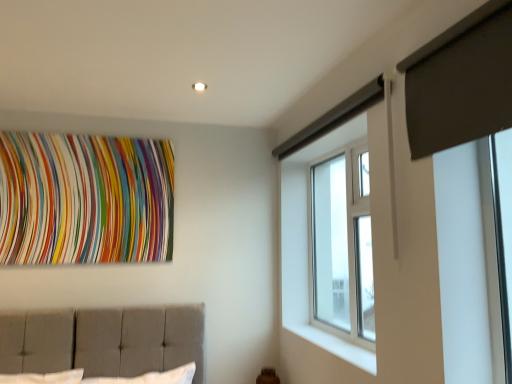
Question: From a real-world perspective, is dark gray fabric at upper right on top of multicolored fabric at upper left?

Choices:
 (A) no
 (B) yes

Answer: (B)

Question: Is dark gray fabric at upper right positioned before multicolored fabric at upper left?

Choices:
 (A) yes
 (B) no

Answer: (A)

Question: Considering the relative sizes of dark gray fabric at upper right and multicolored fabric at upper left in the image provided, is dark gray fabric at upper right thinner than multicolored fabric at upper left?

Choices:
 (A) yes
 (B) no

Answer: (B)

Question: Does dark gray fabric at upper right appear on the left side of multicolored fabric at upper left?

Choices:
 (A) no
 (B) yes

Answer: (A)

Question: From the image's perspective, does dark gray fabric at upper right appear lower than multicolored fabric at upper left?

Choices:
 (A) no
 (B) yes

Answer: (A)

Question: Is multicolored fabric at upper left at the back of dark gray fabric at upper right?

Choices:
 (A) yes
 (B) no

Answer: (B)

Question: Can you confirm if multicolored fabric at upper left is smaller than white smooth window sill at lower right?

Choices:
 (A) yes
 (B) no

Answer: (B)

Question: Does multicolored fabric at upper left turn towards white smooth window sill at lower right?

Choices:
 (A) yes
 (B) no

Answer: (B)

Question: Is multicolored fabric at upper left next to white smooth window sill at lower right?

Choices:
 (A) yes
 (B) no

Answer: (B)

Question: Is multicolored fabric at upper left looking in the opposite direction of white smooth window sill at lower right?

Choices:
 (A) yes
 (B) no

Answer: (B)

Question: Can you confirm if multicolored fabric at upper left is taller than white smooth window sill at lower right?

Choices:
 (A) no
 (B) yes

Answer: (B)

Question: Is multicolored fabric at upper left positioned in front of white smooth window sill at lower right?

Choices:
 (A) no
 (B) yes

Answer: (A)

Question: Can we say clear glass window at upper right lies outside white smooth window sill at lower right?

Choices:
 (A) no
 (B) yes

Answer: (B)